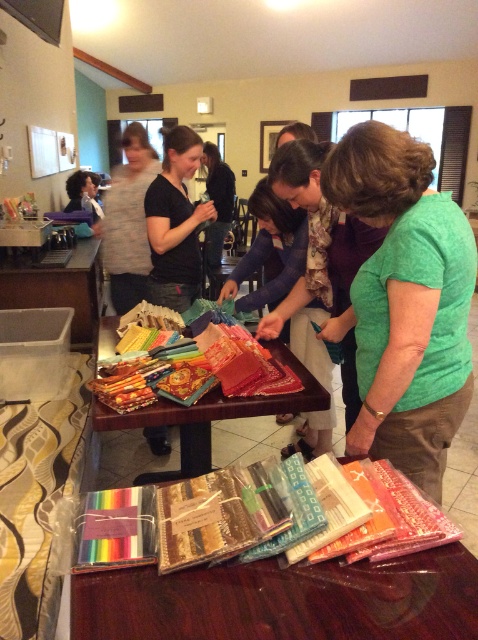
Question: Considering the real-world distances, which object is closest to the textured fabric at center?

Choices:
 (A) green cotton shirt at center
 (B) shiny plastic fabric at center

Answer: (A)

Question: Can you confirm if shiny plastic fabric at center is bigger than matte green shirt at center?

Choices:
 (A) yes
 (B) no

Answer: (B)

Question: Which object is closer to the camera taking this photo?

Choices:
 (A) textured fabric at center
 (B) green cotton shirt at center
 (C) shiny plastic fabric at center

Answer: (C)

Question: Is shiny plastic fabric at center bigger than matte green shirt at center?

Choices:
 (A) no
 (B) yes

Answer: (A)

Question: Which object is the closest to the shiny plastic fabric at center?

Choices:
 (A) textured fabric at center
 (B) green cotton shirt at center
 (C) matte green shirt at center

Answer: (B)

Question: Does matte green shirt at center appear over textured fabric at center?

Choices:
 (A) yes
 (B) no

Answer: (A)